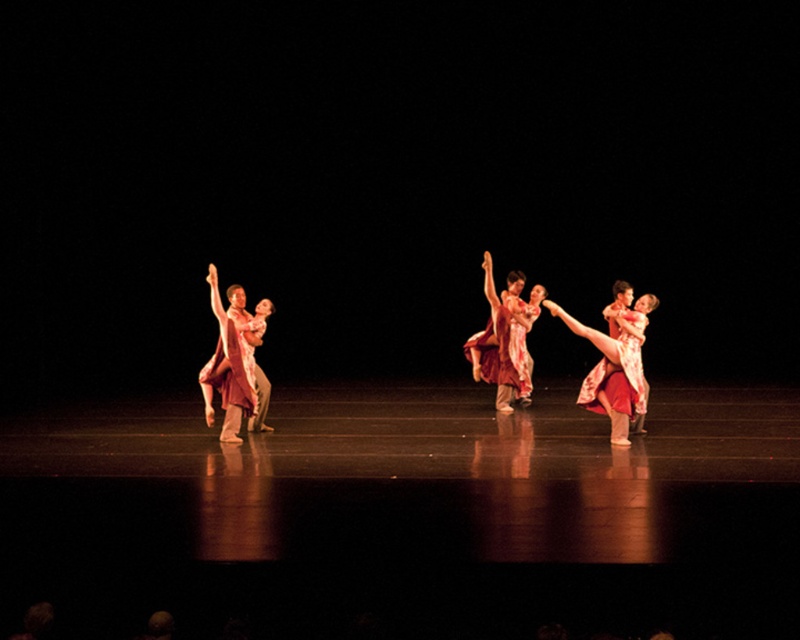
Who is higher up, matte pink dress at right or matte red dress at center?

matte red dress at center

Image resolution: width=800 pixels, height=640 pixels. Describe the element at coordinates (614, 364) in the screenshot. I see `matte pink dress at right` at that location.

Does point (632, 333) come farther from viewer compared to point (496, 332)?

No, (632, 333) is closer to viewer.

Where is `matte pink dress at right`? The height and width of the screenshot is (640, 800). matte pink dress at right is located at coordinates (614, 364).